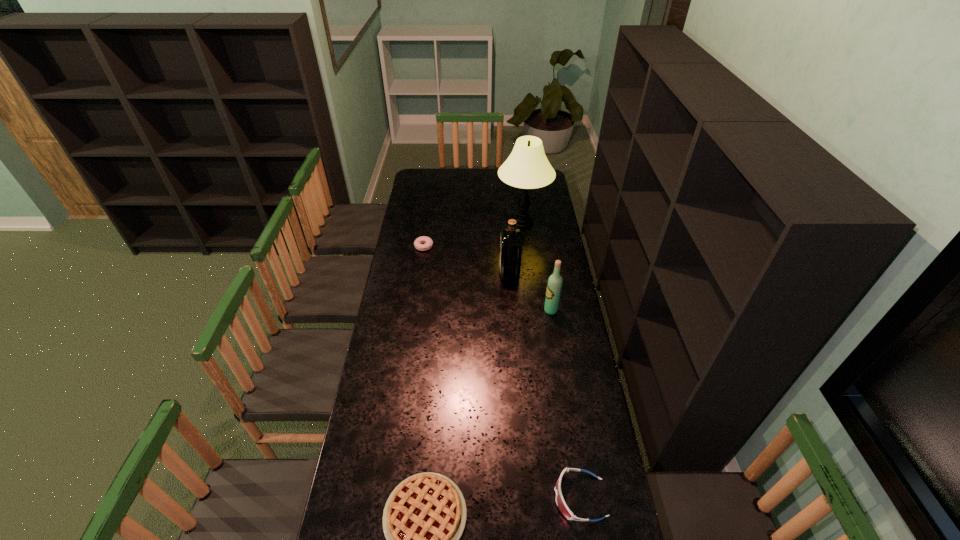
Image resolution: width=960 pixels, height=540 pixels. What are the coordinates of `wine bottle present at the right edge` in the screenshot? It's located at (554, 285).

Locate an element on the screen. goggles that is at the right edge is located at coordinates (561, 504).

Locate an element on the screen. The height and width of the screenshot is (540, 960). vacant area at the left edge of the desktop is located at coordinates (388, 488).

The image size is (960, 540). Find the location of `vacant area at the right edge`. vacant area at the right edge is located at coordinates (558, 423).

This screenshot has width=960, height=540. What are the coordinates of `free region at the far left corner` in the screenshot? It's located at (417, 179).

Identify the location of free space between the goggles and the wine bottle. (565, 404).

You are a GUI agent. You are given a task and a screenshot of the screen. Output one action in this format:
    pyautogui.click(x=<x>, y=<y>)
    Task: Click on the free space between the fourth nearest object and the doughnut
    
    Given the screenshot: What is the action you would take?
    pyautogui.click(x=467, y=259)

In order to click on vacant region between the third shortest object and the liquor in this screenshot , I will do `click(544, 385)`.

Where is `vacant area between the wine bottle and the doughnut`? The height and width of the screenshot is (540, 960). vacant area between the wine bottle and the doughnut is located at coordinates (488, 278).

Locate an element on the screen. The image size is (960, 540). vacant area that lies between the tallest object and the doughnut is located at coordinates (473, 235).